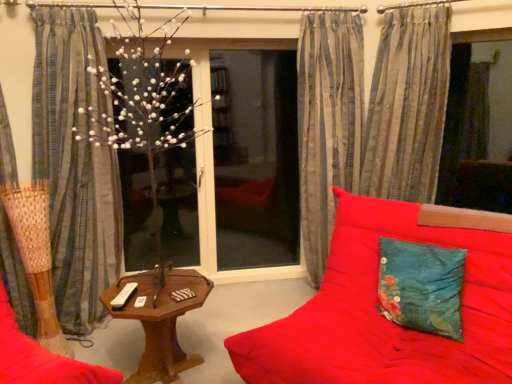
Question: Considering their positions, is woodenobject at center located in front of or behind red fabric couch at center?

Choices:
 (A) front
 (B) behind

Answer: (B)

Question: Considering the positions of woodenobject at center and red fabric couch at center in the image, is woodenobject at center bigger or smaller than red fabric couch at center?

Choices:
 (A) big
 (B) small

Answer: (B)

Question: Considering the real-world distances, which object is farthest from the silky striped curtain at center, which appears as the third curtain when viewed from the left?

Choices:
 (A) striped fabric curtain at right, which appears as the 1th curtain when viewed from the right
 (B) transparent glass screen door at center
 (C) woodenobject at center
 (D) red fabric couch at center
 (E) striped fabric curtain at left, which is the 3th curtain from right to left

Answer: (E)

Question: Estimate the real-world distances between objects in this image. Which object is farther from the striped fabric curtain at right, which is the 4th curtain from left to right?

Choices:
 (A) white artificial tree at center, positioned as the 2th window screen in right-to-left order
 (B) woven bamboo curtain at left, which is the first curtain from left to right
 (C) white matte tree at center
 (D) striped fabric curtain at left, which is the 3th curtain from right to left
 (E) woodenobject at center

Answer: (B)